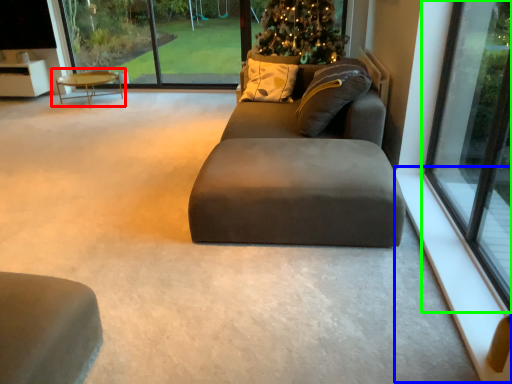
Question: Which object is the closest to the coffee table (highlighted by a red box)? Choose among these: window sill (highlighted by a blue box) or window (highlighted by a green box).

Choices:
 (A) window sill
 (B) window

Answer: (B)